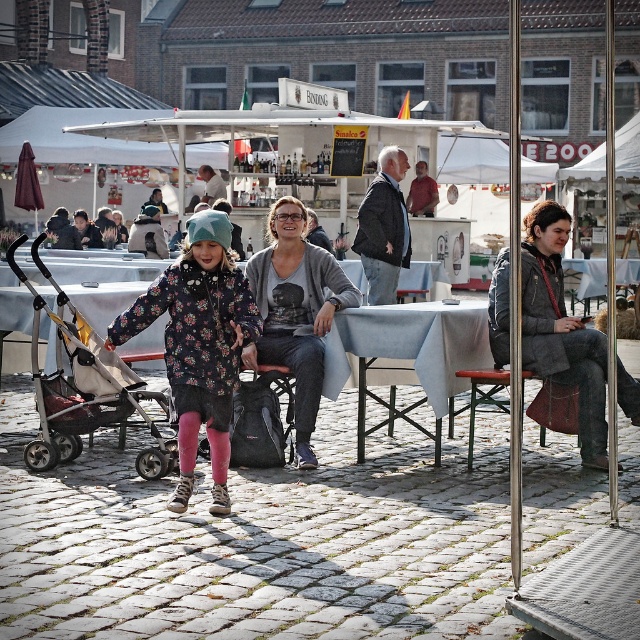
Can you confirm if light blue fabric table at center is wider than dark gray jacket at center?

Yes.

How much distance is there between light blue fabric table at center and dark gray jacket at center?

The distance of light blue fabric table at center from dark gray jacket at center is 5.09 meters.

Is point (440, 403) less distant than point (388, 161)?

Yes, it is in front of point (388, 161).

You are a GUI agent. You are given a task and a screenshot of the screen. Output one action in this format:
    pyautogui.click(x=<x>, y=<y>)
    Task: Click on the light blue fabric table at center
    The width and height of the screenshot is (640, 640).
    Given the screenshot: What is the action you would take?
    pyautogui.click(x=406, y=355)

Does gray woolen coat at center have a larger size compared to dark gray jacket at center?

Indeed, gray woolen coat at center has a larger size compared to dark gray jacket at center.

Does gray woolen coat at center have a lesser width compared to dark gray jacket at center?

No, gray woolen coat at center is not thinner than dark gray jacket at center.

Describe the element at coordinates (561, 328) in the screenshot. This screenshot has width=640, height=640. I see `gray woolen coat at center` at that location.

This screenshot has width=640, height=640. I want to click on gray woolen coat at center, so click(561, 328).

Is black plastic baby carriage at center smaller than dark gray jacket at center?

Actually, black plastic baby carriage at center might be larger than dark gray jacket at center.

How distant is black plastic baby carriage at center from dark gray jacket at center?

black plastic baby carriage at center and dark gray jacket at center are 6.17 meters apart.

Between point (74, 353) and point (385, 276), which one is positioned in front?

Positioned in front is point (74, 353).

Locate an element on the screen. This screenshot has height=640, width=640. black plastic baby carriage at center is located at coordinates (84, 387).